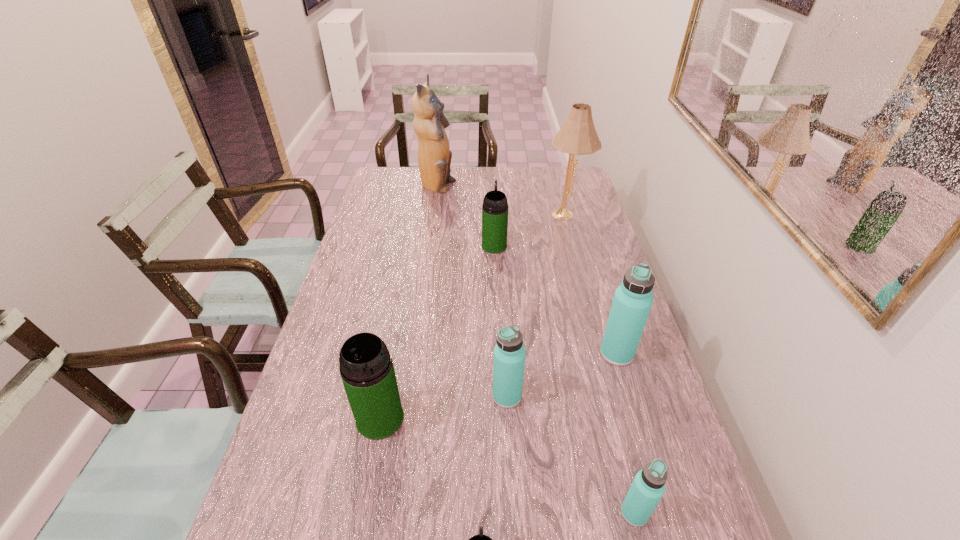
I want to click on cat, so click(434, 156).

Locate an element on the screen. lampshade is located at coordinates (578, 136).

The image size is (960, 540). Identify the location of beige lampshade. (578, 136).

Where is `the leftmost thermos bottle`? The image size is (960, 540). the leftmost thermos bottle is located at coordinates (366, 367).

At what (x,y) coordinates should I click in order to perform the action: click on the second nearest green thermos bottle. Please return your answer as a coordinate pair (x, y). Looking at the image, I should click on (366, 367).

Image resolution: width=960 pixels, height=540 pixels. I want to click on the fifth nearest thermos bottle, so click(x=633, y=299).

Identify the location of the fifth nearest object. Image resolution: width=960 pixels, height=540 pixels. (633, 299).

This screenshot has width=960, height=540. What are the coordinates of `the third farthest object` in the screenshot? It's located at pyautogui.click(x=495, y=205).

The height and width of the screenshot is (540, 960). Identify the location of the farthest thermos bottle. (495, 205).

Identify the location of the second farthest aqua thermos bottle. The width and height of the screenshot is (960, 540). [x=509, y=353].